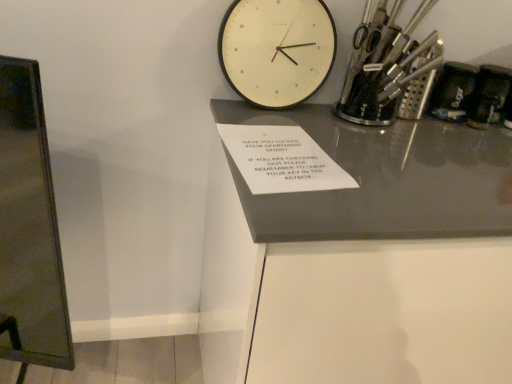
Question: From a real-world perspective, does white matte wall clock at upper center sit lower than black plastic phone at upper right, the 1th stationery viewed from the right?

Choices:
 (A) yes
 (B) no

Answer: (B)

Question: From the image's perspective, does white matte wall clock at upper center appear lower than black plastic phone at upper right, the 1th stationery viewed from the right?

Choices:
 (A) no
 (B) yes

Answer: (A)

Question: Is white matte wall clock at upper center at the right side of black plastic phone at upper right, the 1th stationery viewed from the right?

Choices:
 (A) yes
 (B) no

Answer: (B)

Question: Does white matte wall clock at upper center have a lesser width compared to black plastic phone at upper right, the 2th stationery in the left-to-right sequence?

Choices:
 (A) yes
 (B) no

Answer: (A)

Question: Is white matte wall clock at upper center not close to black plastic phone at upper right, the 1th stationery viewed from the right?

Choices:
 (A) yes
 (B) no

Answer: (B)

Question: Can you see white matte wall clock at upper center touching black plastic phone at upper right, the 1th stationery viewed from the right?

Choices:
 (A) no
 (B) yes

Answer: (A)

Question: Does white glossy table at center have a greater width compared to metallic silver utensils at upper right, the 1th stationery viewed from the left?

Choices:
 (A) no
 (B) yes

Answer: (B)

Question: From a real-world perspective, is white glossy table at center on metallic silver utensils at upper right, the 1th stationery viewed from the left?

Choices:
 (A) no
 (B) yes

Answer: (A)

Question: Would you say white glossy table at center is a long distance from metallic silver utensils at upper right, which is the 2th stationery from right to left?

Choices:
 (A) no
 (B) yes

Answer: (A)

Question: Can you confirm if white glossy table at center is bigger than metallic silver utensils at upper right, the 1th stationery viewed from the left?

Choices:
 (A) yes
 (B) no

Answer: (A)

Question: From a real-world perspective, is white glossy table at center positioned under metallic silver utensils at upper right, which is the 2th stationery from right to left, based on gravity?

Choices:
 (A) yes
 (B) no

Answer: (A)

Question: Is white glossy table at center aimed at metallic silver utensils at upper right, which is the 2th stationery from right to left?

Choices:
 (A) no
 (B) yes

Answer: (A)

Question: Is the depth of white glossy table at center greater than that of white matte wall clock at upper center?

Choices:
 (A) yes
 (B) no

Answer: (B)